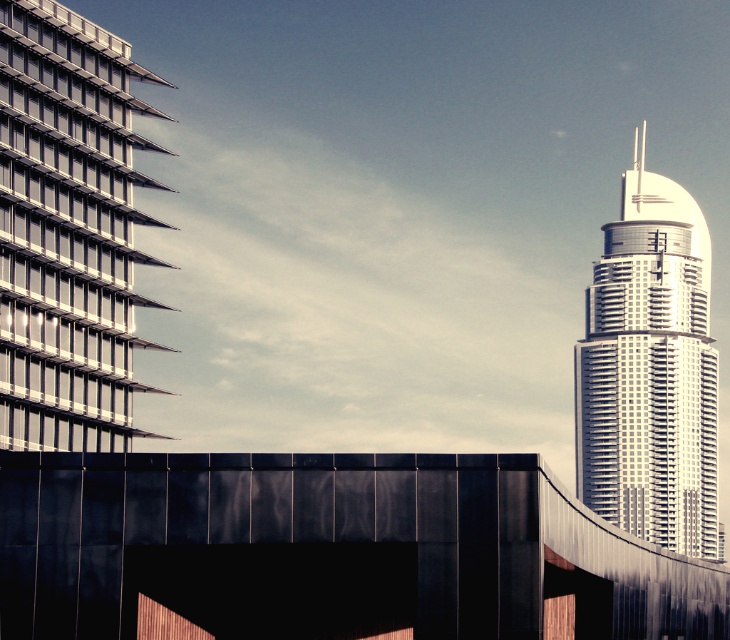
Question: Can you confirm if metallic glass skyscraper at left is wider than silver glass skyscraper at right?

Choices:
 (A) no
 (B) yes

Answer: (A)

Question: Can you confirm if metallic glass skyscraper at left is positioned to the left of silver glass skyscraper at right?

Choices:
 (A) no
 (B) yes

Answer: (B)

Question: Which point is closer to the camera taking this photo?

Choices:
 (A) (69, 358)
 (B) (691, 276)

Answer: (A)

Question: Which point is closer to the camera?

Choices:
 (A) silver glass skyscraper at right
 (B) metallic glass skyscraper at left

Answer: (B)

Question: Which object is closer to the camera taking this photo?

Choices:
 (A) silver glass skyscraper at right
 (B) metallic glass skyscraper at left

Answer: (B)

Question: Does metallic glass skyscraper at left appear on the left side of silver glass skyscraper at right?

Choices:
 (A) no
 (B) yes

Answer: (B)